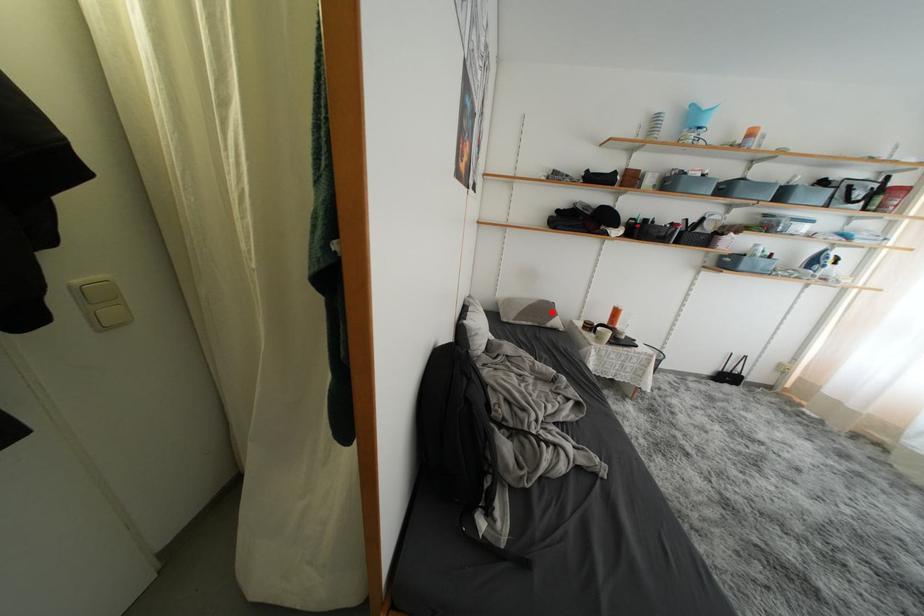
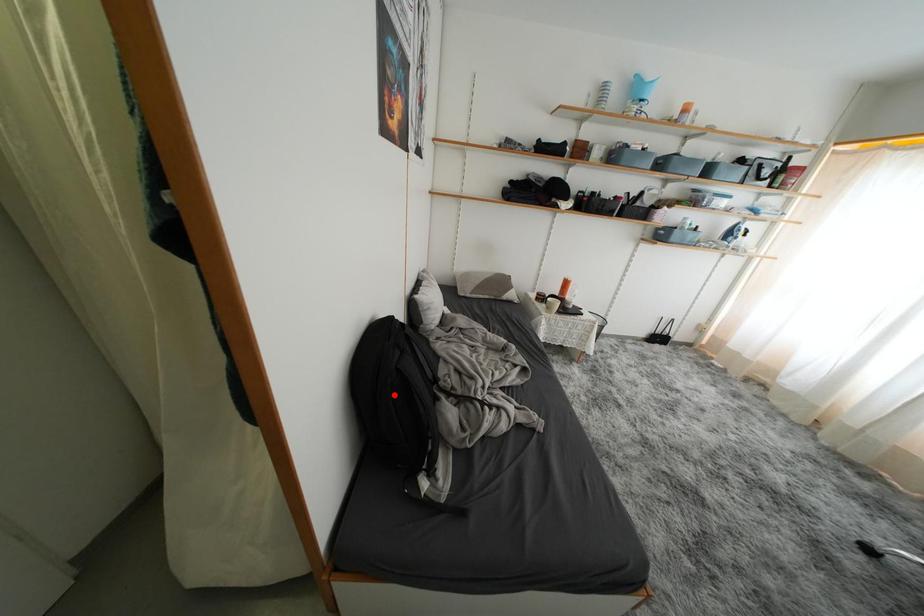
I am providing you with two images of the same scene from different viewpoints. A red point is marked on the first image and another point is marked on the second image. Is the red point in image1 aligned with the point shown in image2?

No